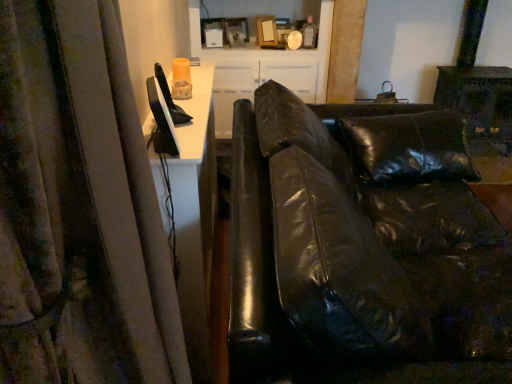
Question: Is matte white cabinet at upper center situated inside black leather couch at center or outside?

Choices:
 (A) inside
 (B) outside

Answer: (B)

Question: Is matte white cabinet at upper center in front of or behind black leather couch at center in the image?

Choices:
 (A) behind
 (B) front

Answer: (A)

Question: From a real-world perspective, relative to black leather couch at center, is matte white cabinet at upper center vertically above or below?

Choices:
 (A) above
 (B) below

Answer: (A)

Question: Does point (426, 145) appear closer or farther from the camera than point (193, 34)?

Choices:
 (A) closer
 (B) farther

Answer: (A)

Question: Based on their sizes in the image, would you say black leather couch at center is bigger or smaller than matte white cabinet at upper center?

Choices:
 (A) small
 (B) big

Answer: (B)

Question: Is black leather couch at center inside the boundaries of matte white cabinet at upper center, or outside?

Choices:
 (A) inside
 (B) outside

Answer: (B)

Question: Considering the positions of black leather couch at center and matte white cabinet at upper center in the image, is black leather couch at center taller or shorter than matte white cabinet at upper center?

Choices:
 (A) tall
 (B) short

Answer: (A)